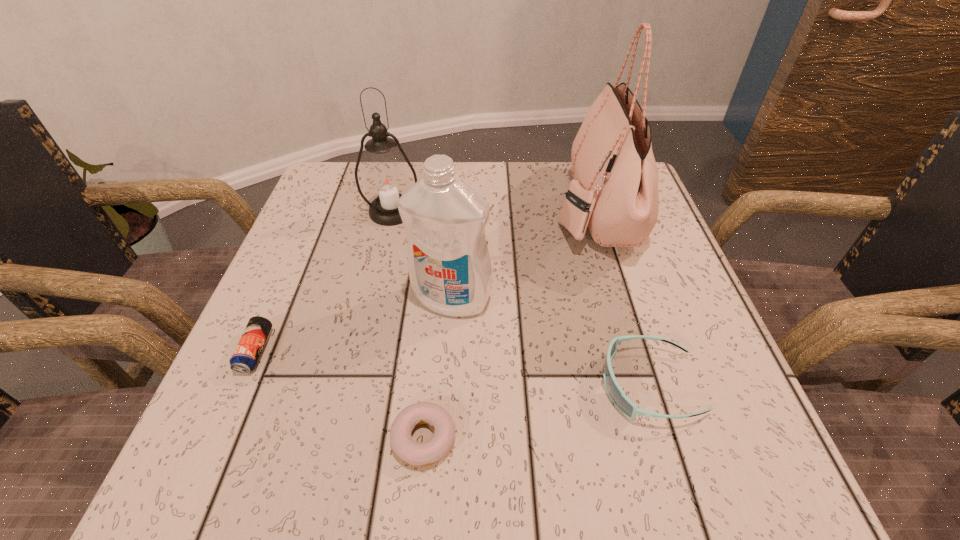
Locate an element on the screen. This screenshot has width=960, height=540. doughnut located in the near edge section of the desktop is located at coordinates (414, 453).

This screenshot has width=960, height=540. Find the location of `oil lamp at the left edge`. oil lamp at the left edge is located at coordinates (386, 180).

You are a GUI agent. You are given a task and a screenshot of the screen. Output one action in this format:
    pyautogui.click(x=<x>, y=<y>)
    Task: Click on the beer can that is at the left edge
    The height and width of the screenshot is (540, 960).
    Given the screenshot: What is the action you would take?
    [x=244, y=359]

Where is `handbag at the right edge`? handbag at the right edge is located at coordinates (614, 191).

The image size is (960, 540). I want to click on goggles that is at the right edge, so click(623, 403).

Where is `object located in the far left corner section of the desktop`? This screenshot has width=960, height=540. object located in the far left corner section of the desktop is located at coordinates (386, 180).

Identify the location of object situated at the far right corner. The image size is (960, 540). (614, 191).

Where is `object at the near right corner`? The height and width of the screenshot is (540, 960). object at the near right corner is located at coordinates (623, 403).

Identify the location of free space at the far edge. (481, 192).

The image size is (960, 540). In the image, there is a desktop. Find the location of `vacant area at the near edge`. vacant area at the near edge is located at coordinates (417, 477).